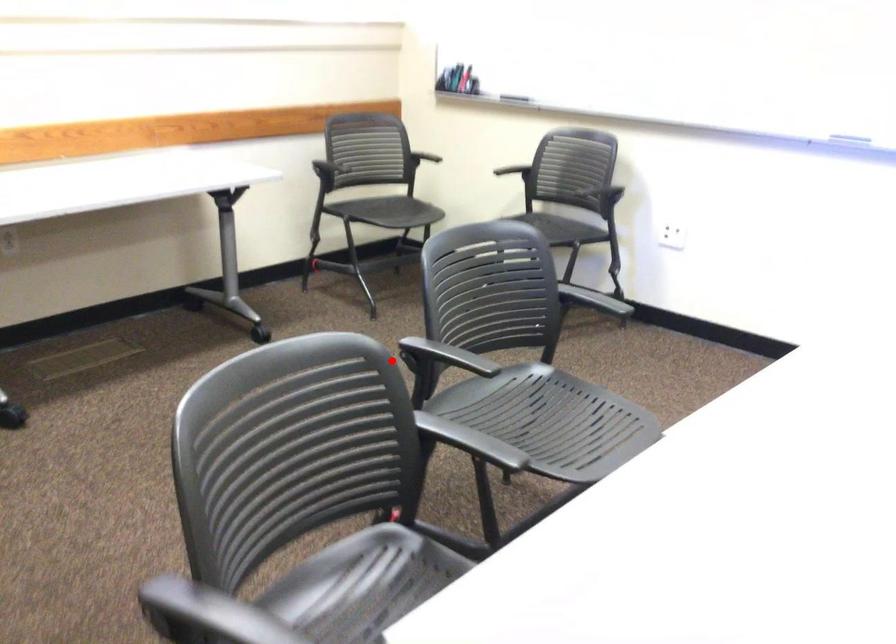
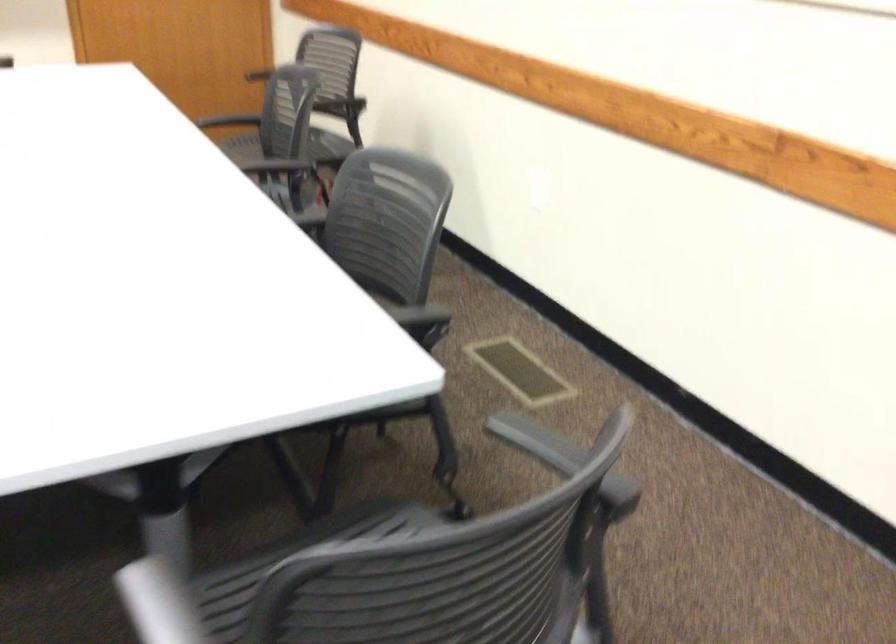
In the second image, find the point that corresponds to the highlighted location in the first image.

(293, 560)